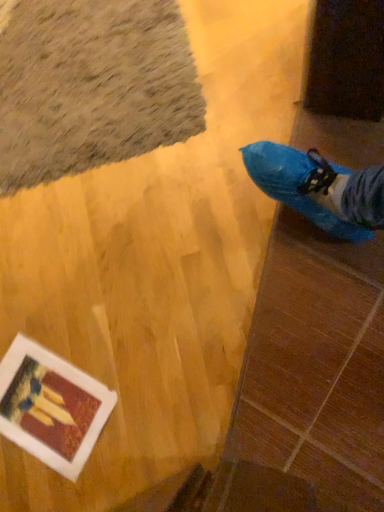
What are the coordinates of `empty space that is ontop of white matte painting at lower left (from a real-world perspective)` in the screenshot? It's located at (50, 403).